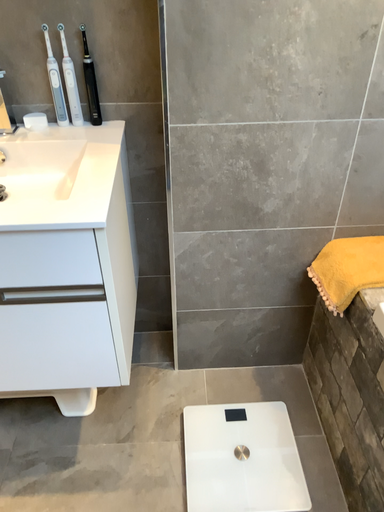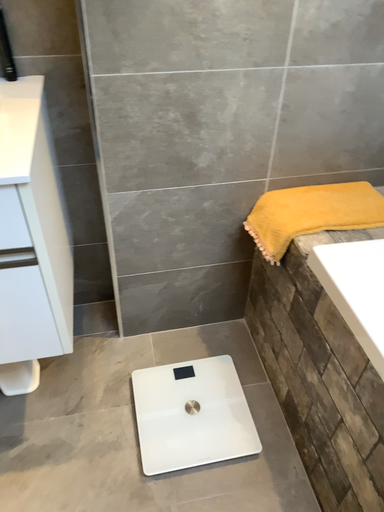
Question: How did the camera likely rotate when shooting the video?

Choices:
 (A) rotated right
 (B) rotated left

Answer: (A)